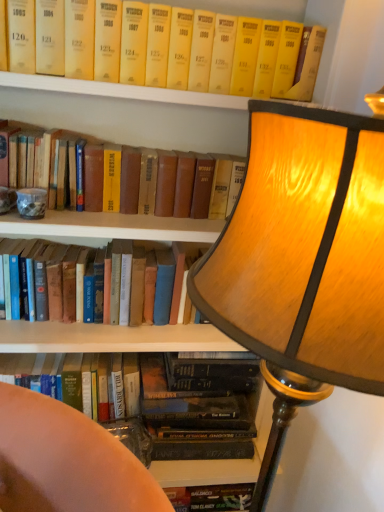
Question: From a real-world perspective, is yellow paperback book at upper center, which appears as the 4th book when ordered from the bottom, above or below hardcover book at left, which is the third book in top-to-bottom order?

Choices:
 (A) below
 (B) above

Answer: (B)

Question: Is yellow paperback book at upper center, the 1th book when ordered from top to bottom, spatially inside hardcover book at left, which is the third book in top-to-bottom order, or outside of it?

Choices:
 (A) inside
 (B) outside

Answer: (B)

Question: Considering the real-world distances, which object is farthest from the hardcover book at lower left, which is the 1th book in bottom-to-top order?

Choices:
 (A) wooden lampshade at upper right
 (B) yellow hardcover book at upper center, which appears as the 3th book when ordered from the bottom
 (C) yellow paperback book at upper center, which appears as the 4th book when ordered from the bottom
 (D) hardcover book at left, arranged as the second book when ordered from the bottom

Answer: (C)

Question: Which is nearer to the hardcover book at lower left, which is the 1th book in bottom-to-top order?

Choices:
 (A) yellow hardcover book at upper center, which appears as the 3th book when ordered from the bottom
 (B) hardcover book at left, arranged as the second book when ordered from the bottom
 (C) wooden lampshade at upper right
 (D) yellow paperback book at upper center, which appears as the 4th book when ordered from the bottom

Answer: (B)